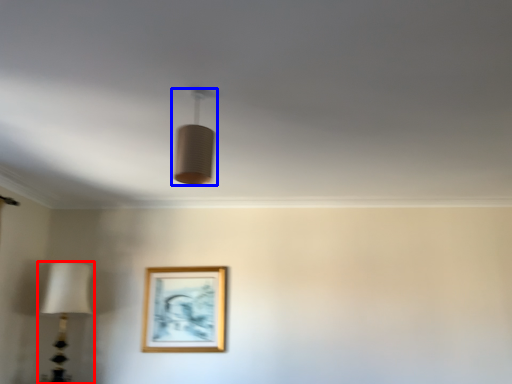
Question: Which point is closer to the camera, lamp (highlighted by a red box) or lamp (highlighted by a blue box)?

Choices:
 (A) lamp
 (B) lamp

Answer: (B)